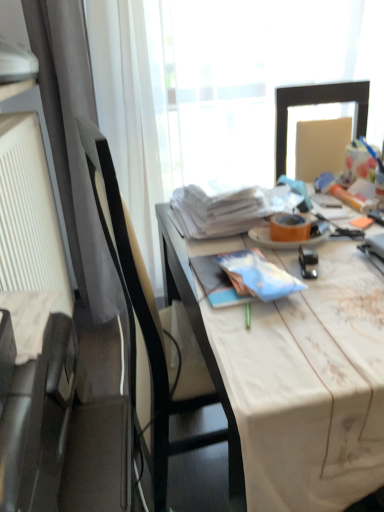
Locate an element on the screen. free point to the right of orange matte plate at center is located at coordinates (349, 232).